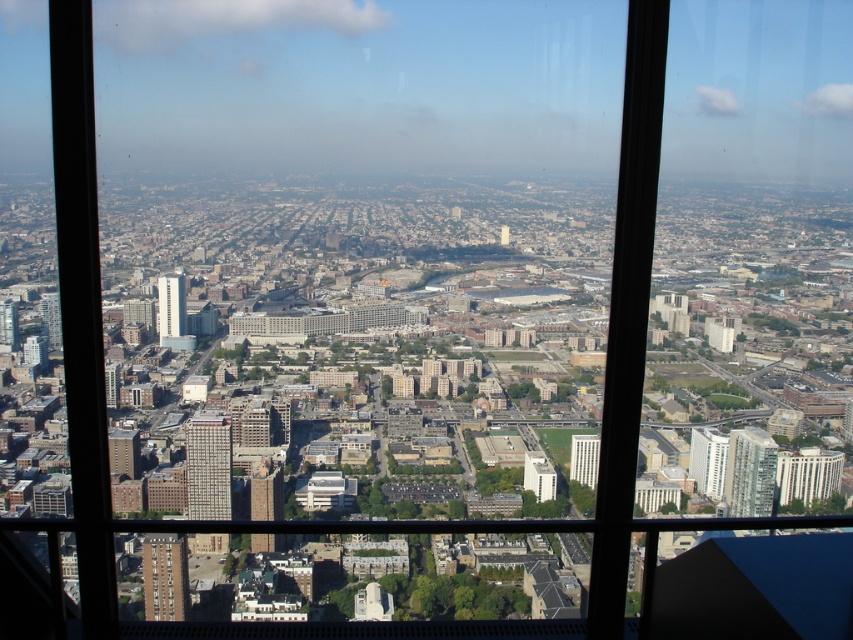
Does brick textured building at center have a lesser height compared to white glass skyscraper at center-left?

Incorrect, brick textured building at center's height does not fall short of white glass skyscraper at center-left's.

Can you confirm if brick textured building at center is thinner than white glass skyscraper at center-left?

Incorrect, brick textured building at center's width is not less than white glass skyscraper at center-left's.

Between point (189, 461) and point (177, 278), which one is positioned in front?

Point (177, 278) is more forward.

Image resolution: width=853 pixels, height=640 pixels. What are the coordinates of `brick textured building at center` in the screenshot? It's located at (207, 467).

Does glassy reflective building at center right have a lesser height compared to light beige concrete building at center?

No, glassy reflective building at center right is not shorter than light beige concrete building at center.

Measure the distance between point (737, 456) and camera.

A distance of 707.12 meters exists between point (737, 456) and camera.

At what (x,y) coordinates should I click in order to perform the action: click on glassy reflective building at center right. Please return your answer as a coordinate pair (x, y). Looking at the image, I should click on (750, 472).

Which is below, glassy reflective building at center right or matte brown building at lower left?

matte brown building at lower left is lower down.

Who is higher up, glassy reflective building at center right or matte brown building at lower left?

glassy reflective building at center right is higher up.

What do you see at coordinates (750, 472) in the screenshot? The width and height of the screenshot is (853, 640). I see `glassy reflective building at center right` at bounding box center [750, 472].

Locate an element on the screen. glassy reflective building at center right is located at coordinates (750, 472).